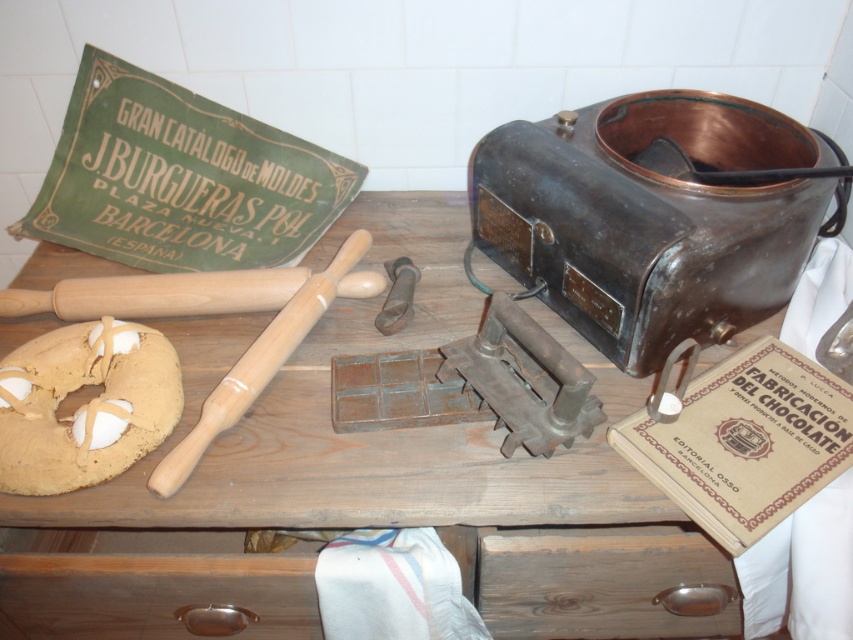
Question: Considering the relative positions of wooden table at center and golden brown doughnut at center-left in the image provided, where is wooden table at center located with respect to golden brown doughnut at center-left?

Choices:
 (A) left
 (B) right

Answer: (B)

Question: Is dark brown wood drawer at lower center above golden brown doughnut at center-left?

Choices:
 (A) no
 (B) yes

Answer: (A)

Question: Among these objects, which one is farthest from the camera?

Choices:
 (A) dark brown wood drawer at lower center
 (B) wooden table at center

Answer: (A)

Question: Among these objects, which one is farthest from the camera?

Choices:
 (A) golden brown doughnut at center-left
 (B) wooden table at center
 (C) dark brown wood drawer at lower center

Answer: (C)

Question: Does dark brown wood drawer at lower center have a larger size compared to golden brown doughnut at center-left?

Choices:
 (A) no
 (B) yes

Answer: (B)

Question: Based on their relative distances, which object is farther from the dark brown wood drawer at lower center?

Choices:
 (A) golden brown doughnut at center-left
 (B) wooden table at center

Answer: (A)